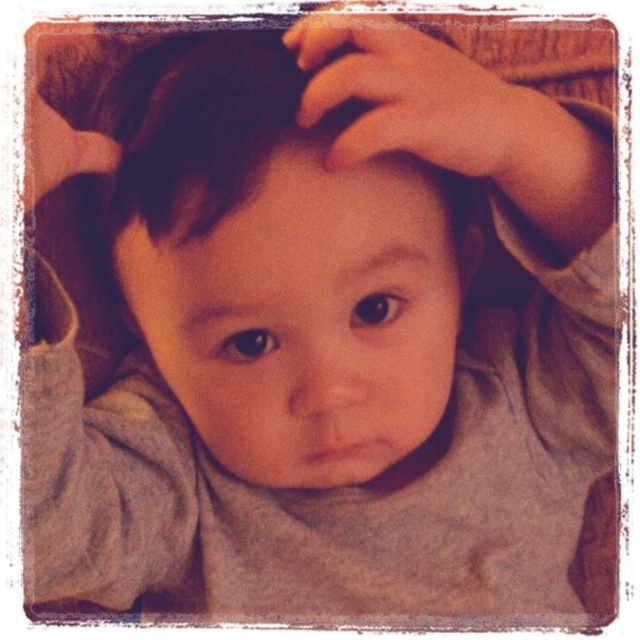
Between point (97, 115) and point (499, 124), which one is positioned behind?

Point (97, 115)

Measure the distance between point (205, 152) and camera.

Point (205, 152) and camera are 20.82 inches apart.

What are the coordinates of `dark brown silky hair at center` in the screenshot? It's located at (204, 125).